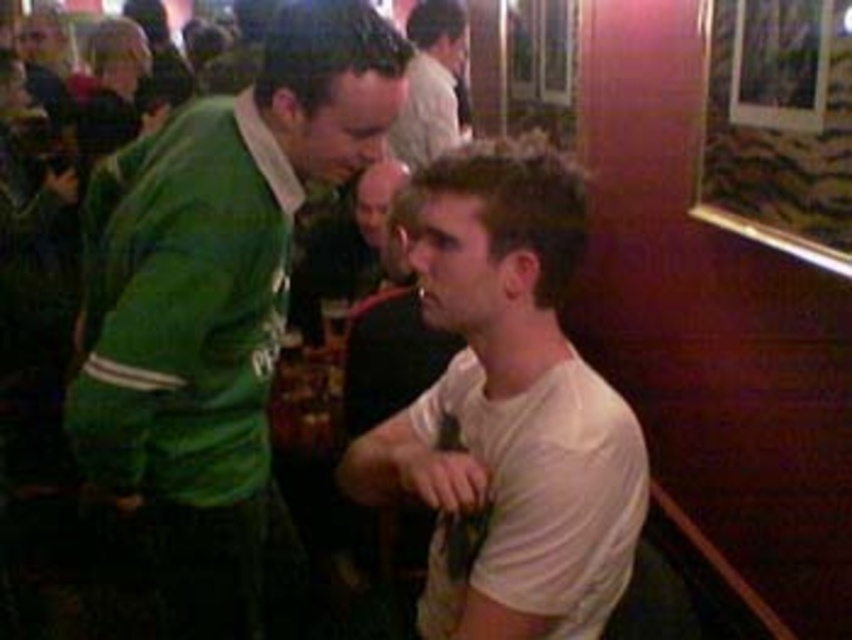
You are at the entrance of the event and want to find the green jersey at center. Based on the coordinates provided, in which direction should you move from your current position to locate it?

The green jersey at center is located at coordinates point (x=217, y=304), which means it is positioned slightly to the right and lower center of the image. Move towards the middle area slightly towards the right from your current position at the entrance to find it.